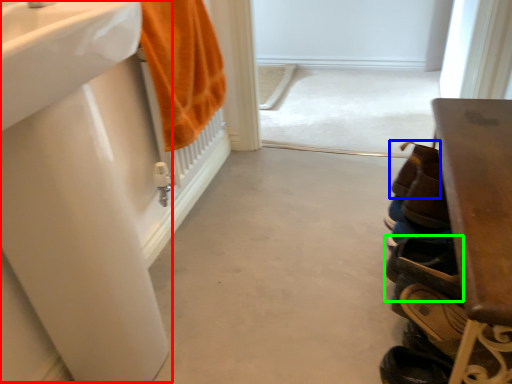
Question: Which is farther away from sink (highlighted by a red box)? shoe (highlighted by a blue box) or footwear (highlighted by a green box)?

Choices:
 (A) shoe
 (B) footwear

Answer: (A)